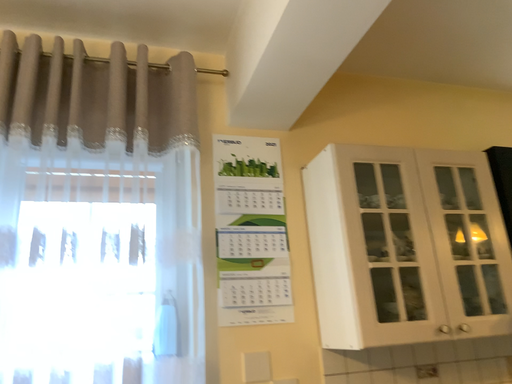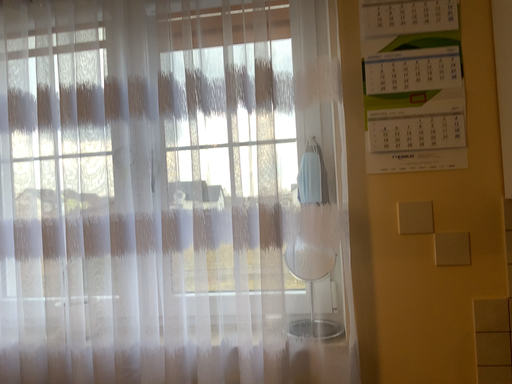
Question: Which way did the camera rotate in the video?

Choices:
 (A) rotated downward
 (B) rotated upward

Answer: (A)